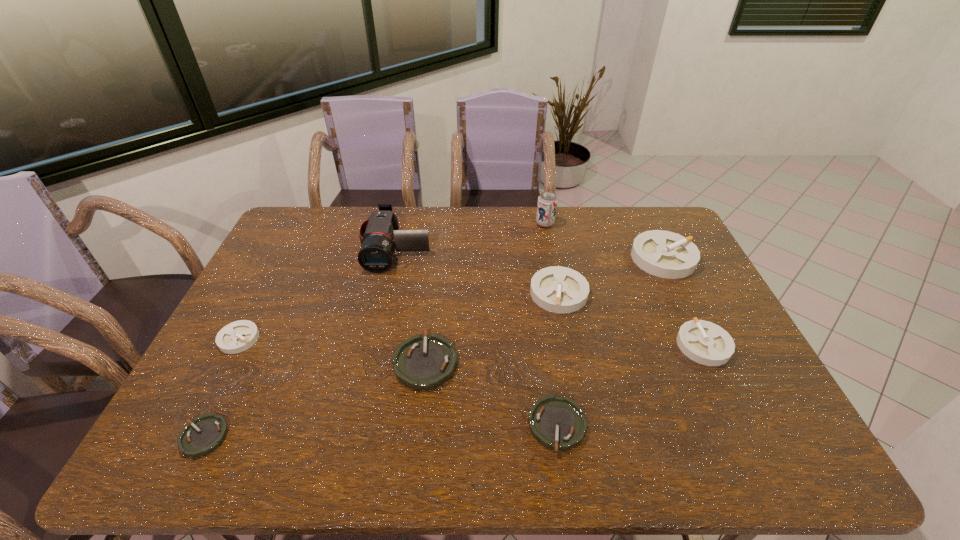
Image resolution: width=960 pixels, height=540 pixels. I want to click on free space in the image that satisfies the following two spatial constraints: 1. on the lens of the third smallest gray ashtray; 2. on the left side of the camcorder, so click(387, 293).

Locate an element on the screen. This screenshot has height=540, width=960. vacant space that satisfies the following two spatial constraints: 1. on the back side of the leftmost gray ashtray; 2. on the right side of the third tallest object is located at coordinates (281, 258).

Where is `free point that satisfies the following two spatial constraints: 1. on the front side of the farthest green ashtray; 2. on the left side of the smallest gray ashtray`? This screenshot has height=540, width=960. free point that satisfies the following two spatial constraints: 1. on the front side of the farthest green ashtray; 2. on the left side of the smallest gray ashtray is located at coordinates (227, 362).

This screenshot has height=540, width=960. Identify the location of vacant space that satisfies the following two spatial constraints: 1. on the lens of the camcorder; 2. on the right side of the biggest gray ashtray. (395, 258).